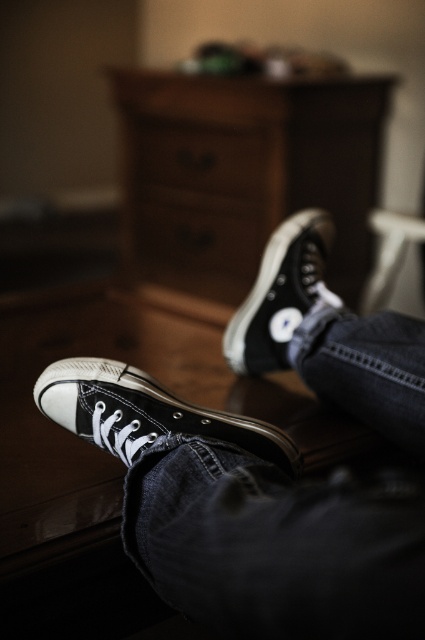
Looking at this image, does black canvas sneakers at lower center have a lesser width compared to black canvas sneakers at center?

No, black canvas sneakers at lower center is not thinner than black canvas sneakers at center.

Where is `black canvas sneakers at lower center`? This screenshot has height=640, width=425. black canvas sneakers at lower center is located at coordinates (243, 516).

The height and width of the screenshot is (640, 425). I want to click on black canvas sneakers at lower center, so click(x=243, y=516).

Does black canvas sneakers at lower center have a greater width compared to wooden dresser at center?

No, black canvas sneakers at lower center is not wider than wooden dresser at center.

Between black canvas sneakers at lower center and wooden dresser at center, which one is positioned lower?

black canvas sneakers at lower center is lower down.

Who is more forward, (317, 234) or (274, 134)?

Point (317, 234)

Locate an element on the screen. black canvas sneakers at lower center is located at coordinates click(x=243, y=516).

Identify the location of black canvas sneakers at lower center. Image resolution: width=425 pixels, height=640 pixels. (243, 516).

Find the location of a particular element. The width and height of the screenshot is (425, 640). black canvas sneakers at lower center is located at coordinates (243, 516).

Locate an element on the screen. black canvas sneakers at lower center is located at coordinates (243, 516).